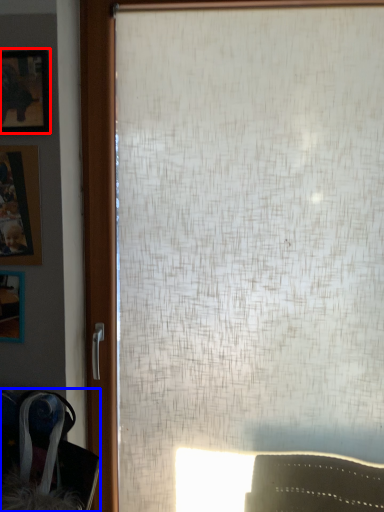
Question: Which of the following is the farthest to the observer, picture frame (highlighted by a red box) or swivel chair (highlighted by a blue box)?

Choices:
 (A) picture frame
 (B) swivel chair

Answer: (A)